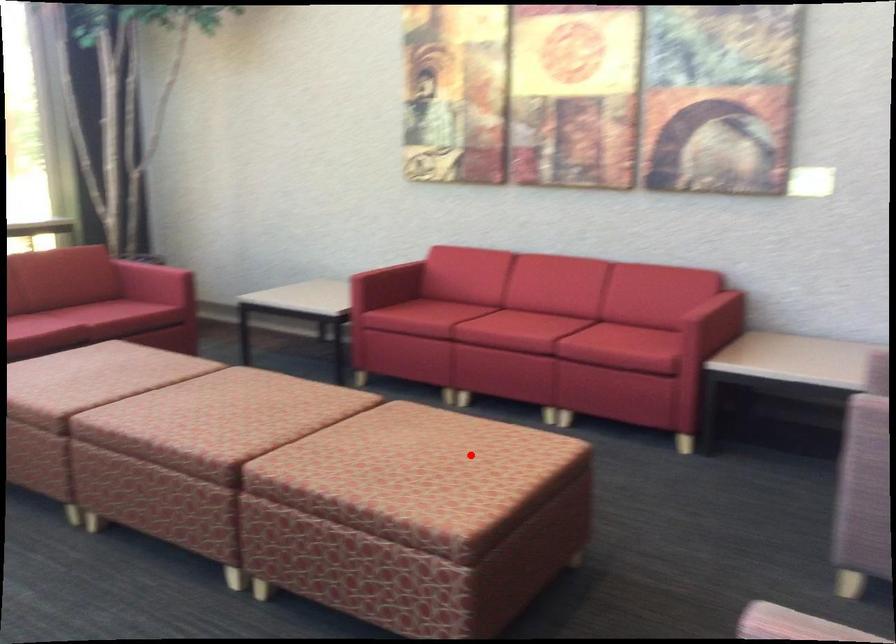
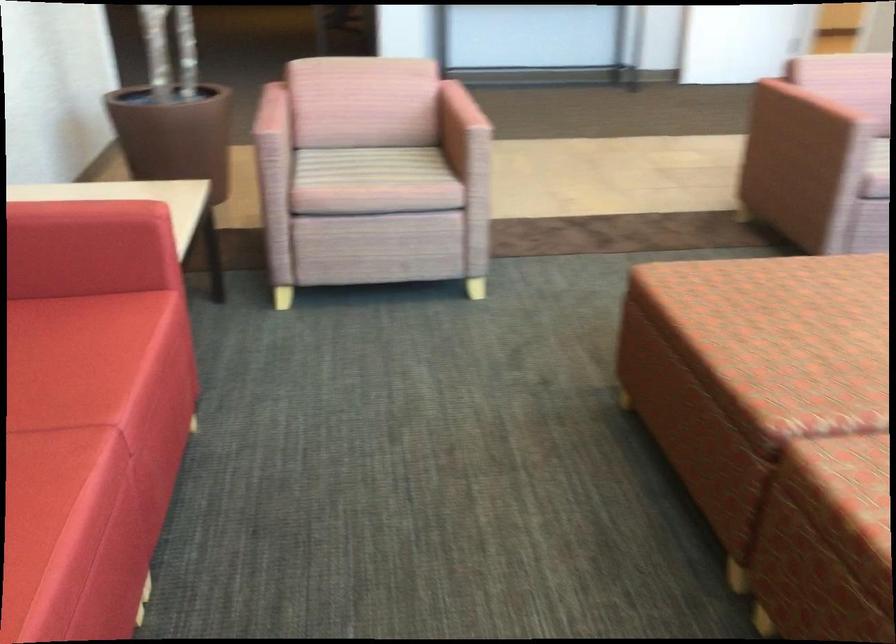
The point at the highlighted location is marked in the first image. Where is the corresponding point in the second image?

(805, 304)